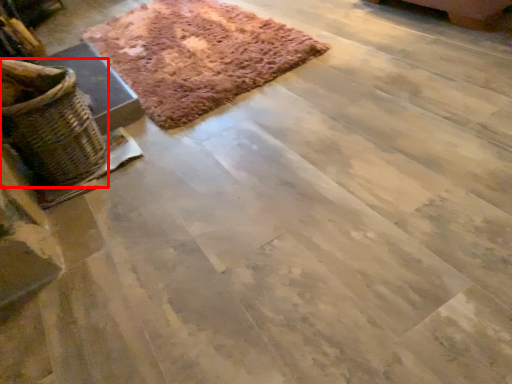
Question: From the image's perspective, where is basket (annotated by the red box) located in relation to mat in the image?

Choices:
 (A) below
 (B) above

Answer: (A)